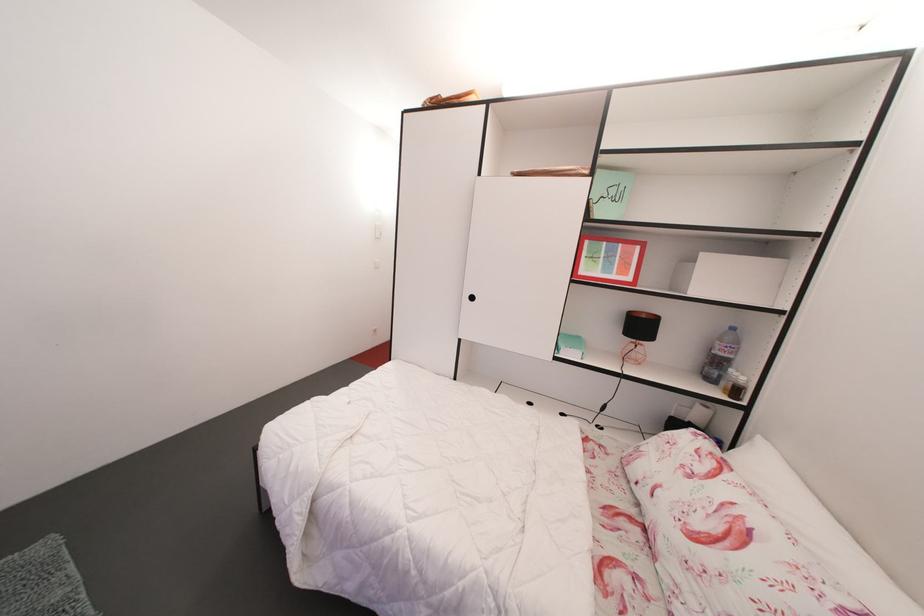
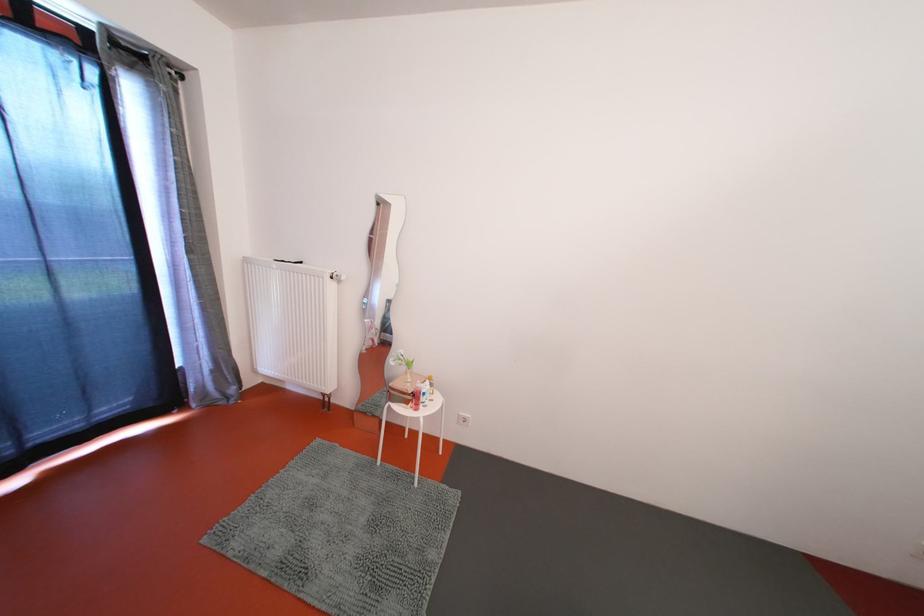
Question: The first image is from the beginning of the video and the second image is from the end. How did the camera likely rotate when shooting the video?

Choices:
 (A) Left
 (B) Right
 (C) Up
 (D) Down

Answer: (A)